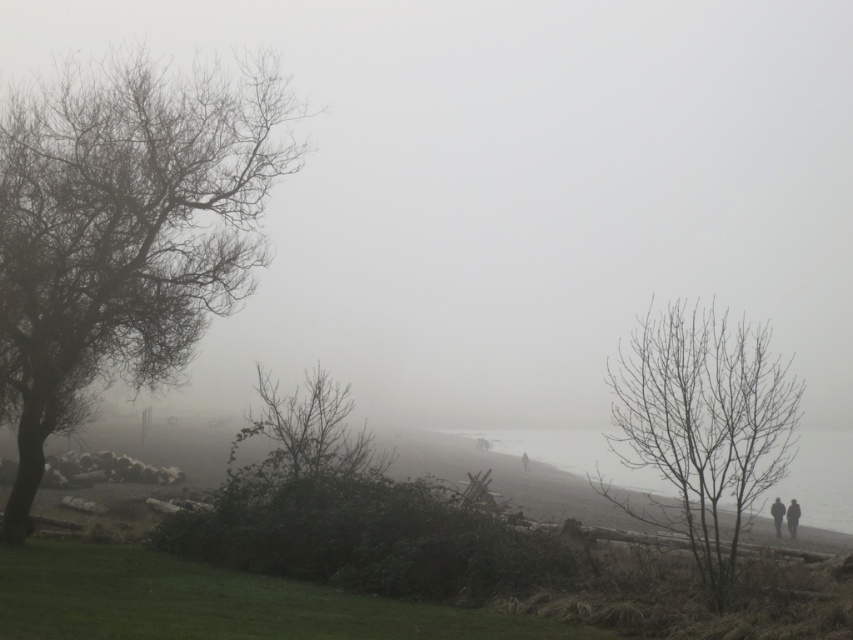
Does point (720, 483) come farther from viewer compared to point (814, 480)?

That is False.

Can you confirm if bare branches at right is positioned to the right of gray foggy water at center?

In fact, bare branches at right is to the left of gray foggy water at center.

Is point (630, 413) farther from viewer compared to point (828, 483)?

That is False.

You are a GUI agent. You are given a task and a screenshot of the screen. Output one action in this format:
    pyautogui.click(x=<x>, y=<y>)
    Task: Click on the bare branches at right
    
    Given the screenshot: What is the action you would take?
    pyautogui.click(x=701, y=426)

Is bare branches at center shorter than dark gray fabric person at lower right?

Incorrect, bare branches at center's height does not fall short of dark gray fabric person at lower right's.

Does point (318, 468) come closer to viewer compared to point (778, 509)?

Yes.

The width and height of the screenshot is (853, 640). In order to click on bare branches at center in this screenshot , I will do `click(306, 433)`.

Can you confirm if bare branches at center is thinner than dark gray fabric jacket at lower right?

No.

Which of these two, bare branches at center or dark gray fabric jacket at lower right, stands shorter?

dark gray fabric jacket at lower right is shorter.

Is point (331, 461) positioned in front of point (790, 524)?

Yes, point (331, 461) is closer to viewer.

Find the location of a particular element. bare branches at center is located at coordinates (306, 433).